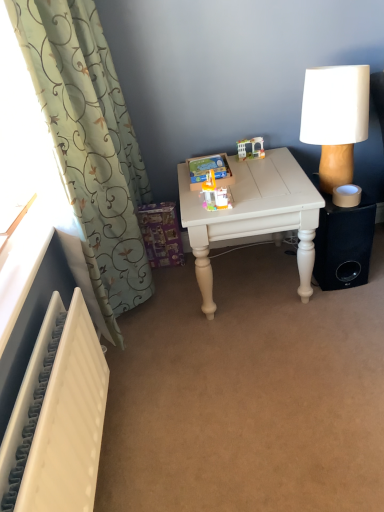
You are a GUI agent. You are given a task and a screenshot of the screen. Output one action in this format:
    pyautogui.click(x=<x>, y=<y>)
    Task: Click on the vacant space to the right of translucent plastic toy at center, the 1th toy in the front-to-back sequence
    The image size is (384, 512).
    Given the screenshot: What is the action you would take?
    pyautogui.click(x=256, y=195)